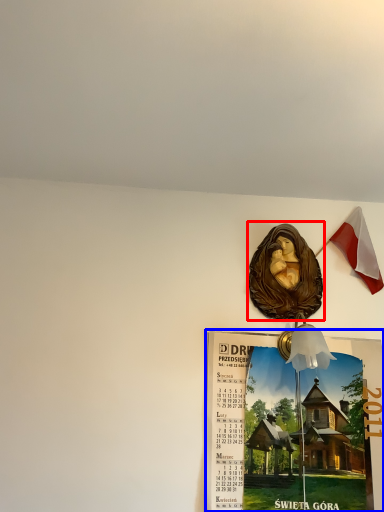
Question: Which of the following is the farthest to the observer, art (highlighted by a red box) or poster page (highlighted by a blue box)?

Choices:
 (A) art
 (B) poster page

Answer: (A)